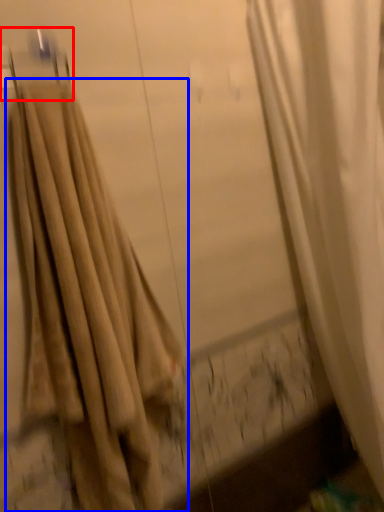
Question: Which object is further to the camera taking this photo, hanger (highlighted by a red box) or curtain (highlighted by a blue box)?

Choices:
 (A) hanger
 (B) curtain

Answer: (A)